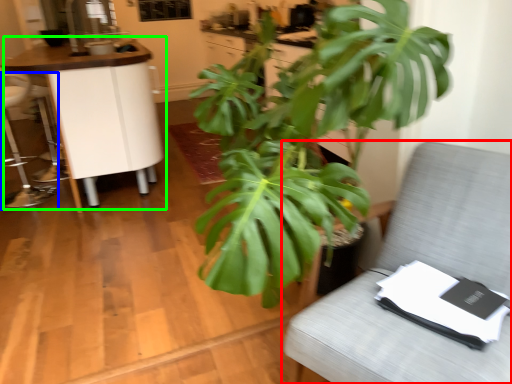
Question: Considering the real-world distances, which object is farthest from furniture (highlighted by a red box)? swivel chair (highlighted by a blue box) or table (highlighted by a green box)?

Choices:
 (A) swivel chair
 (B) table

Answer: (A)